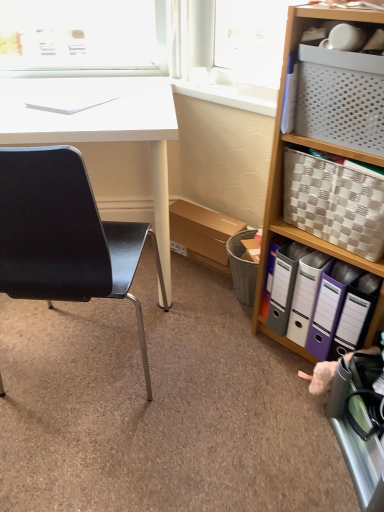
Where is `vacant area that is in front of black matte chair at left`? This screenshot has height=512, width=384. vacant area that is in front of black matte chair at left is located at coordinates (85, 467).